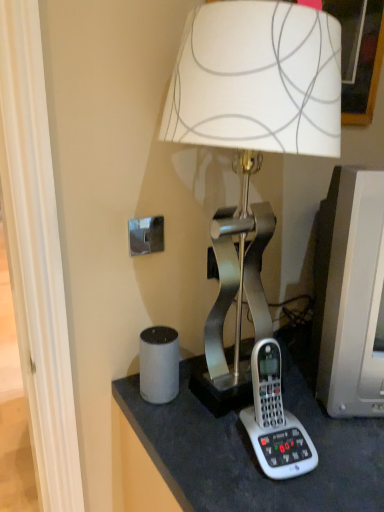
Question: From a real-world perspective, is matte gray monitor at right on top of metallic silver lamp at center?

Choices:
 (A) no
 (B) yes

Answer: (A)

Question: Does matte gray monitor at right have a larger size compared to metallic silver lamp at center?

Choices:
 (A) yes
 (B) no

Answer: (B)

Question: Can you confirm if matte gray monitor at right is taller than metallic silver lamp at center?

Choices:
 (A) no
 (B) yes

Answer: (A)

Question: Is matte gray monitor at right wider than metallic silver lamp at center?

Choices:
 (A) yes
 (B) no

Answer: (B)

Question: Is metallic silver lamp at center at the back of matte gray monitor at right?

Choices:
 (A) no
 (B) yes

Answer: (A)

Question: Is matte gray monitor at right closer to camera compared to metallic silver lamp at center?

Choices:
 (A) no
 (B) yes

Answer: (A)

Question: Is white plastic corded phone at lower right positioned beyond the bounds of metallic silver lamp at center?

Choices:
 (A) no
 (B) yes

Answer: (A)

Question: Is white plastic corded phone at lower right positioned with its back to metallic silver lamp at center?

Choices:
 (A) no
 (B) yes

Answer: (B)

Question: Does white plastic corded phone at lower right have a greater width compared to metallic silver lamp at center?

Choices:
 (A) no
 (B) yes

Answer: (A)

Question: Can you confirm if white plastic corded phone at lower right is smaller than metallic silver lamp at center?

Choices:
 (A) no
 (B) yes

Answer: (B)

Question: From the image's perspective, would you say white plastic corded phone at lower right is shown under metallic silver lamp at center?

Choices:
 (A) yes
 (B) no

Answer: (A)

Question: From a real-world perspective, is white plastic corded phone at lower right positioned under metallic silver lamp at center based on gravity?

Choices:
 (A) no
 (B) yes

Answer: (B)

Question: Is white plastic corded phone at lower right further to camera compared to matte gray monitor at right?

Choices:
 (A) yes
 (B) no

Answer: (B)